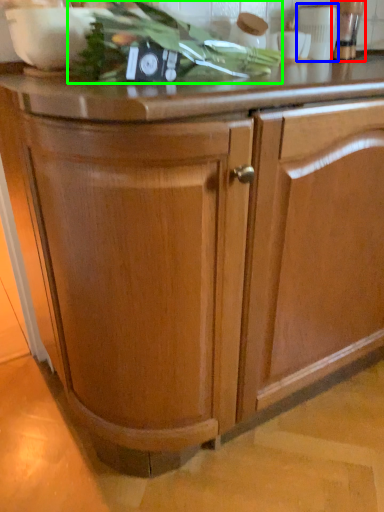
Question: Which object is the farthest from appliance (highlighted by a red box)? Choose among these: appliance (highlighted by a blue box) or vegetable (highlighted by a green box).

Choices:
 (A) appliance
 (B) vegetable

Answer: (B)